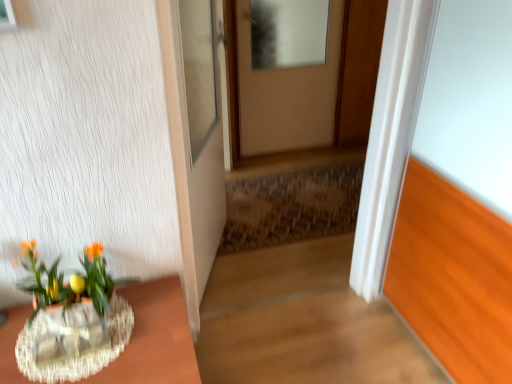
Identify the location of vacant space that is to the left of clear glass vase at lower left. (30, 344).